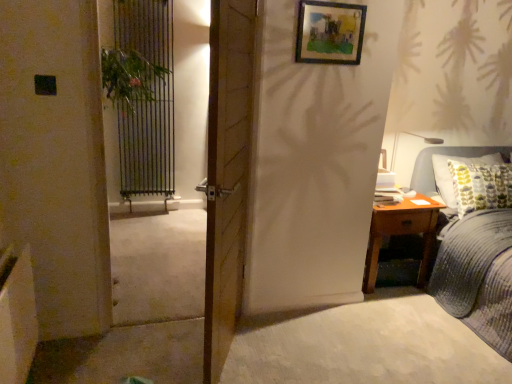
Identify the location of wooden door at center. (227, 173).

This screenshot has width=512, height=384. What do you see at coordinates (408, 154) in the screenshot?
I see `matte gray table lamp at right` at bounding box center [408, 154].

Image resolution: width=512 pixels, height=384 pixels. What do you see at coordinates (478, 276) in the screenshot? I see `blue corduroy bed at right` at bounding box center [478, 276].

Identify the location of brown wooden nightstand at right. This screenshot has height=384, width=512. (402, 233).

What is the approximate width of green leafy plant at left?

green leafy plant at left is 16.11 centimeters in width.

In order to face green leafy plant at left, should I rotate leftwards or rightwards?

Turn left approximately 15.032 degrees to face it.

What is the approximate width of wooden framed artwork at upper center?

It is 1.48 inches.

Where is `wooden door at center`? The height and width of the screenshot is (384, 512). wooden door at center is located at coordinates (227, 173).

From the picture: Is matte gray table lamp at right next to wooden framed artwork at upper center?

matte gray table lamp at right is not next to wooden framed artwork at upper center, and they're not touching.

Can you confirm if matte gray table lamp at right is smaller than wooden framed artwork at upper center?

No.

At what (x,y) coordinates should I click in order to perform the action: click on picture frame above the matte gray table lamp at right (from a real-world perspective). Please return your answer as a coordinate pair (x, y). Looking at the image, I should click on (329, 32).

Which is in front, matte gray table lamp at right or wooden framed artwork at upper center?

Positioned in front is wooden framed artwork at upper center.

Considering the sizes of green leafy plant at left and brown wooden nightstand at right in the image, is green leafy plant at left wider or thinner than brown wooden nightstand at right?

green leafy plant at left is thinner than brown wooden nightstand at right.

Which is in front, point (113, 85) or point (428, 207)?

Positioned in front is point (113, 85).

Image resolution: width=512 pixels, height=384 pixels. In order to click on nightstand on the right of green leafy plant at left in this screenshot , I will do `click(402, 233)`.

From their relative heights in the image, would you say wooden door at center is taller or shorter than matte gray table lamp at right?

In the image, wooden door at center appears to be taller than matte gray table lamp at right.

From a real-world perspective, who is located higher, wooden door at center or matte gray table lamp at right?

wooden door at center.

Is wooden door at center aimed at matte gray table lamp at right?

No, wooden door at center is not turned towards matte gray table lamp at right.

Is matte gray table lamp at right located within wooden door at center?

No, wooden door at center does not contain matte gray table lamp at right.

Is point (139, 48) in front of point (362, 32)?

No, it is behind (362, 32).

From the image's perspective, is green leafy plant at left on wooden framed artwork at upper center?

No.

Based on the photo, how many degrees apart are the facing directions of green leafy plant at left and wooden framed artwork at upper center?

0.00573 degrees separate the facing orientations of green leafy plant at left and wooden framed artwork at upper center.

From a real-world perspective, is green leafy plant at left beneath wooden framed artwork at upper center?

Yes, from a real-world perspective, green leafy plant at left is beneath wooden framed artwork at upper center.

Between blue corduroy bed at right and wooden framed artwork at upper center, which one appears on the left side from the viewer's perspective?

Positioned to the left is wooden framed artwork at upper center.

Is blue corduroy bed at right oriented towards wooden framed artwork at upper center?

No.

Considering their positions, is blue corduroy bed at right located in front of or behind wooden framed artwork at upper center?

Visually, blue corduroy bed at right is located in front of wooden framed artwork at upper center.

Can you confirm if blue corduroy bed at right is thinner than wooden framed artwork at upper center?

Incorrect, the width of blue corduroy bed at right is not less than that of wooden framed artwork at upper center.

From the picture: Which of these two, green leafy plant at left or blue corduroy bed at right, is bigger?

blue corduroy bed at right.

What's the angular difference between green leafy plant at left and blue corduroy bed at right's facing directions?

0.0862 degrees.

From a real-world perspective, who is located higher, green leafy plant at left or blue corduroy bed at right?

green leafy plant at left is physically above.

Image resolution: width=512 pixels, height=384 pixels. Identify the location of plant that is on the left side of blue corduroy bed at right. (130, 77).

From a real-world perspective, is wooden framed artwork at upper center positioned above or below blue corduroy bed at right?

wooden framed artwork at upper center is above blue corduroy bed at right.

Can you tell me how much wooden framed artwork at upper center and blue corduroy bed at right differ in facing direction?

They differ by 0.0871 degrees in their facing directions.

Are wooden framed artwork at upper center and blue corduroy bed at right far apart?

Yes, wooden framed artwork at upper center is far from blue corduroy bed at right.

Between wooden framed artwork at upper center and blue corduroy bed at right, which one has smaller size?

wooden framed artwork at upper center.

Locate an element on the screen. The height and width of the screenshot is (384, 512). table lamp on the right of wooden framed artwork at upper center is located at coordinates (408, 154).

Identify the location of plant on the left of brown wooden nightstand at right. (130, 77).

Which object lies nearer to the anchor point green leafy plant at left, green leafy plant at left or matte gray table lamp at right?

Based on the image, green leafy plant at left appears to be nearer to green leafy plant at left.

When comparing their distances from wooden door at center, does blue corduroy bed at right or green leafy plant at left seem closer?

The object closer to wooden door at center is blue corduroy bed at right.

When comparing their distances from wooden framed artwork at upper center, does matte gray table lamp at right or green leafy plant at left seem closer?

matte gray table lamp at right is positioned closer to the anchor wooden framed artwork at upper center.

When comparing their distances from wooden framed artwork at upper center, does blue corduroy bed at right or green leafy plant at left seem closer?

green leafy plant at left is positioned closer to the anchor wooden framed artwork at upper center.

Which object lies nearer to the anchor point wooden door at center, wooden framed artwork at upper center or brown wooden nightstand at right?

wooden framed artwork at upper center lies closer to wooden door at center than the other object.

Estimate the real-world distances between objects in this image. Which object is closer to blue corduroy bed at right, green leafy plant at left or matte gray table lamp at right?

matte gray table lamp at right is positioned closer to the anchor blue corduroy bed at right.

Considering their positions, is blue corduroy bed at right positioned further to green leafy plant at left than wooden framed artwork at upper center?

blue corduroy bed at right lies further to green leafy plant at left than the other object.

Looking at this image, considering their positions, is wooden framed artwork at upper center positioned further to matte gray table lamp at right than wooden door at center?

wooden door at center lies further to matte gray table lamp at right than the other object.

Where is `picture frame between wooden door at center and blue corduroy bed at right from left to right`? The height and width of the screenshot is (384, 512). picture frame between wooden door at center and blue corduroy bed at right from left to right is located at coordinates (329, 32).

This screenshot has width=512, height=384. I want to click on door located between green leafy plant at left and matte gray table lamp at right in the left-right direction, so click(227, 173).

Image resolution: width=512 pixels, height=384 pixels. Find the location of `plant between green leafy plant at left and brown wooden nightstand at right from left to right`. plant between green leafy plant at left and brown wooden nightstand at right from left to right is located at coordinates point(130,77).

You are a GUI agent. You are given a task and a screenshot of the screen. Output one action in this format:
    pyautogui.click(x=<x>, y=<y>)
    Task: Click on the door located between green leafy plant at left and blue corduroy bed at right in the left-right direction
    The height and width of the screenshot is (384, 512).
    Given the screenshot: What is the action you would take?
    pyautogui.click(x=227, y=173)